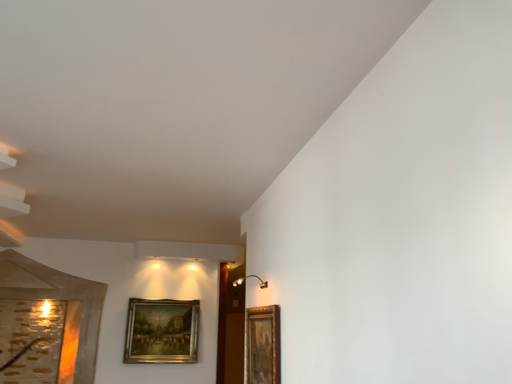
Question: From a real-world perspective, is gold-toned wooden picture frame at right, which is the 1th picture frame from right to left, physically located above or below gold-framed painting at center-left, placed as the 2th picture frame when sorted from front to back?

Choices:
 (A) below
 (B) above

Answer: (A)

Question: Is gold-toned wooden picture frame at right, which is the 1th picture frame from right to left, wider or thinner than gold-framed painting at center-left, the 2th picture frame positioned from the top?

Choices:
 (A) thin
 (B) wide

Answer: (A)

Question: Is point (253, 354) closer or farther from the camera than point (148, 352)?

Choices:
 (A) closer
 (B) farther

Answer: (A)

Question: From a real-world perspective, is gold-framed painting at center-left, the first picture frame positioned from the bottom, positioned above or below gold-toned wooden picture frame at right, which is the 1th picture frame from right to left?

Choices:
 (A) above
 (B) below

Answer: (A)

Question: Considering the positions of point (181, 362) and point (267, 374), is point (181, 362) closer or farther from the camera than point (267, 374)?

Choices:
 (A) closer
 (B) farther

Answer: (B)

Question: Is gold-framed painting at center-left, the first picture frame positioned from the bottom, wider or thinner than gold-toned wooden picture frame at right, which is counted as the 2th picture frame, starting from the left?

Choices:
 (A) wide
 (B) thin

Answer: (A)

Question: From the image's perspective, is gold-framed painting at center-left, the 2th picture frame viewed from the right, positioned above or below gold-toned wooden picture frame at right, the second picture frame when ordered from back to front?

Choices:
 (A) above
 (B) below

Answer: (B)